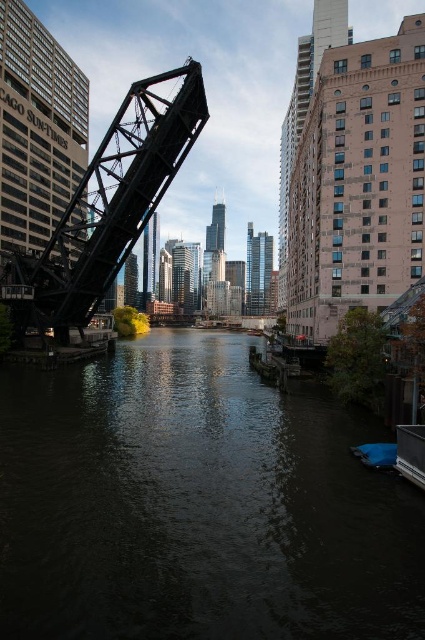
Does dark water at center have a larger size compared to black steel bridge at left?

No, dark water at center is not bigger than black steel bridge at left.

Who is higher up, dark water at center or black steel bridge at left?

black steel bridge at left is above.

Locate an element on the screen. Image resolution: width=425 pixels, height=640 pixels. dark water at center is located at coordinates (197, 504).

Is dark water at center further to the viewer compared to blue fabric boat at lower right?

No, dark water at center is in front of blue fabric boat at lower right.

Which of these two, dark water at center or blue fabric boat at lower right, stands shorter?

blue fabric boat at lower right is shorter.

Is point (14, 403) less distant than point (351, 449)?

No, it is not.

Where is `dark water at center`? The image size is (425, 640). dark water at center is located at coordinates (197, 504).

Is black steel bridge at left bigger than blue fabric boat at lower right?

Yes.

Is black steel bridge at left to the left of blue fabric boat at lower right from the viewer's perspective?

Answer: Indeed, black steel bridge at left is positioned on the left side of blue fabric boat at lower right.

Is point (192, 83) closer to viewer compared to point (388, 458)?

No, (192, 83) is further to viewer.

Where is `black steel bridge at left`? black steel bridge at left is located at coordinates (107, 205).